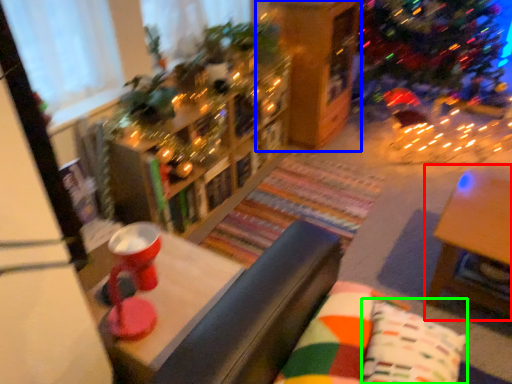
Question: Which object is positioned farthest from table (highlighted by a red box)? Select from shelf (highlighted by a blue box) and pillow (highlighted by a green box).

Choices:
 (A) shelf
 (B) pillow

Answer: (A)